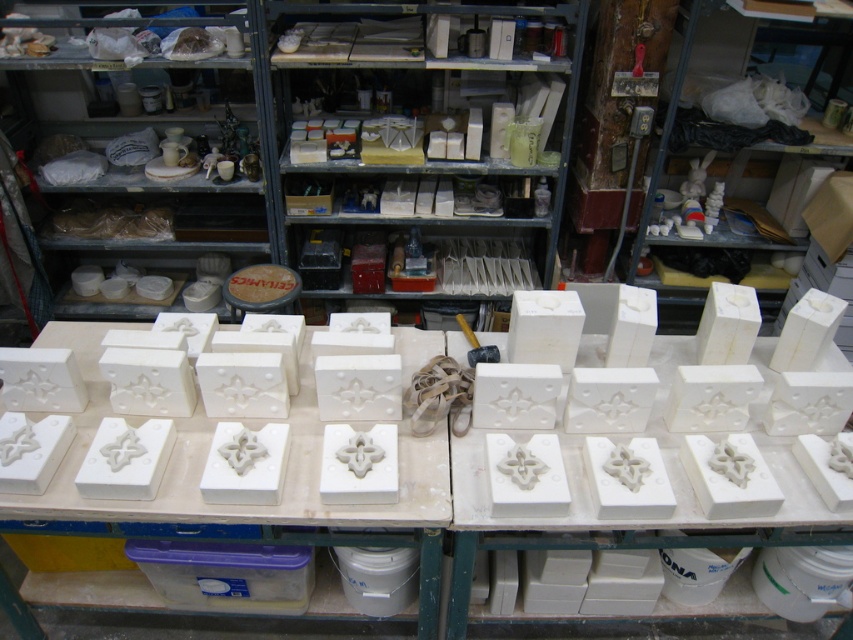
Which is behind, point (407, 228) or point (819, 24)?

Positioned behind is point (407, 228).

Does white matte shelves at center have a lesser height compared to white matte blocks at upper right?

Answer: Correct, white matte shelves at center is not as tall as white matte blocks at upper right.

Is point (450, 164) behind point (749, 148)?

No, it is not.

At what (x,y) coordinates should I click in order to perform the action: click on white matte shelves at center. Please return your answer as a coordinate pair (x, y). The height and width of the screenshot is (640, 853). Looking at the image, I should click on (434, 124).

Who is lower down, white matte shelves at center or translucent plastic container at lower center?

translucent plastic container at lower center is lower down.

Can you confirm if white matte shelves at center is positioned to the left of translucent plastic container at lower center?

Incorrect, white matte shelves at center is not on the left side of translucent plastic container at lower center.

Which is in front, point (563, 76) or point (157, 586)?

Point (157, 586) is more forward.

The width and height of the screenshot is (853, 640). I want to click on white matte shelves at center, so click(x=434, y=124).

Identify the location of translucent plastic container at lower center. (225, 573).

Does translucent plastic container at lower center appear on the left side of white matte shelves at upper left?

No, translucent plastic container at lower center is not to the left of white matte shelves at upper left.

Locate an element on the screen. translucent plastic container at lower center is located at coordinates (225, 573).

Locate an element on the screen. translucent plastic container at lower center is located at coordinates (225, 573).